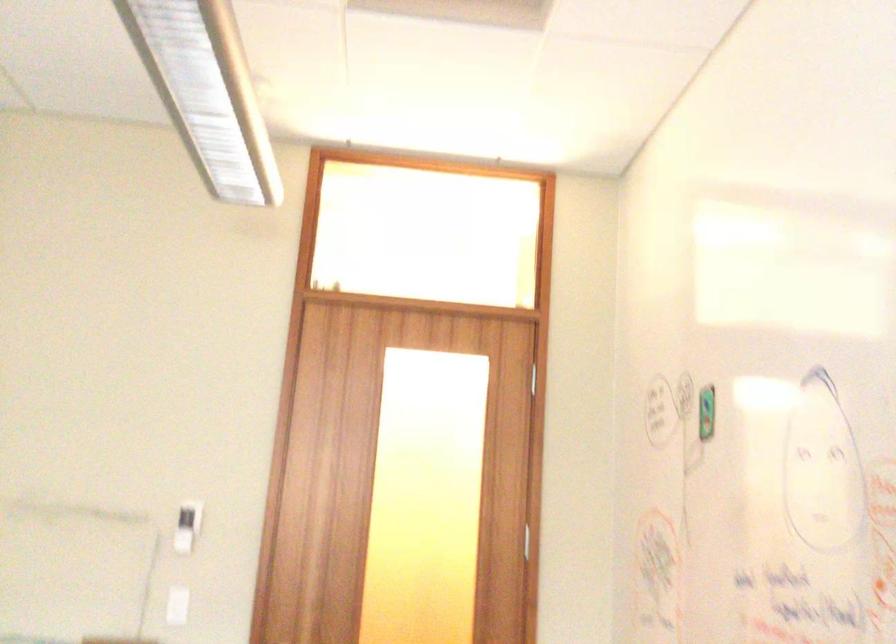
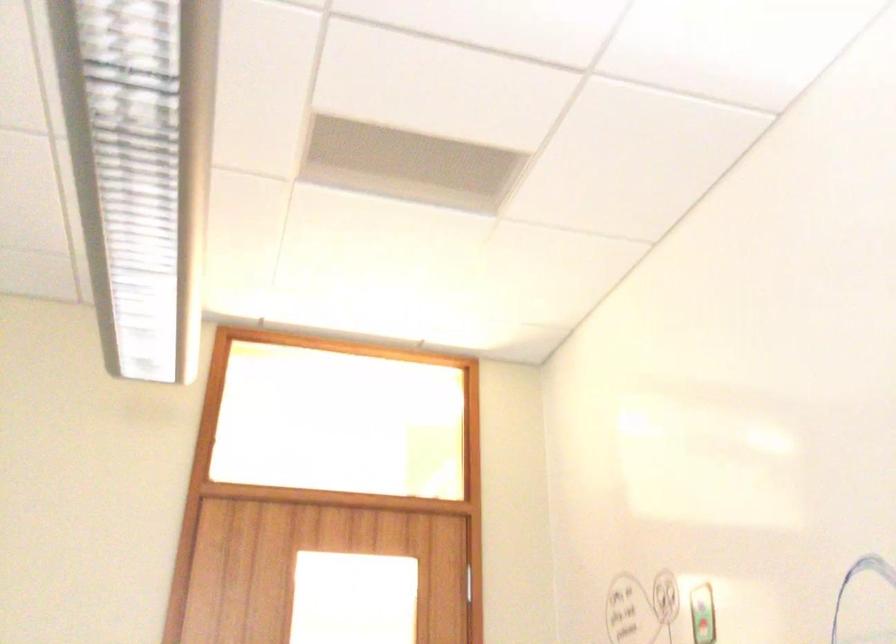
Question: Based on the continuous images, in which direction is the camera rotating? Reply with the corresponding letter.

Choices:
 (A) Left
 (B) Right
 (C) Up
 (D) Down

Answer: (C)